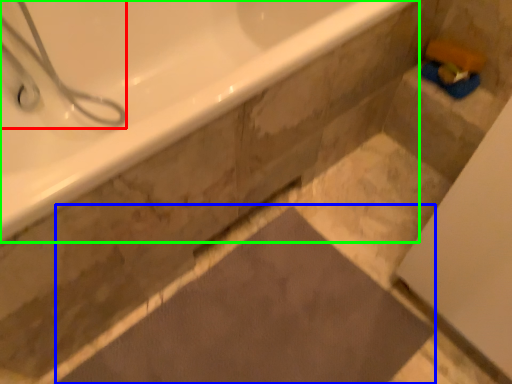
Question: Which is nearer to the shower (highlighted by a red box)? bath mat (highlighted by a blue box) or bathtub (highlighted by a green box).

Choices:
 (A) bath mat
 (B) bathtub

Answer: (B)